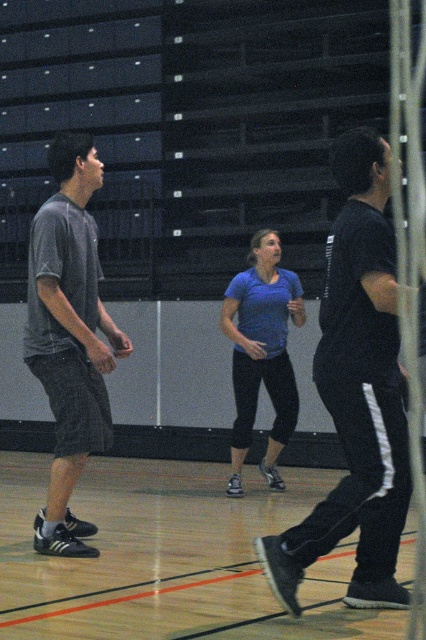
You are standing in the gymnasium and want to place a small mat on the wooden floor at center so that it doesn not interfere with the blue matte shirt at center. Where should you place the mat?

The wooden floor at center is located below the blue matte shirt at center, so placing the mat on the wooden floor at center directly underneath the blue matte shirt at center would ensure it does not interfere with their activity.

In the scene shown: You are a gym instructor observing the wooden floor at center and the dark gray shorts at left. Which object is located below the other?

The wooden floor at center is positioned under dark gray shorts at left, meaning the wooden floor is below the dark gray shorts at left.